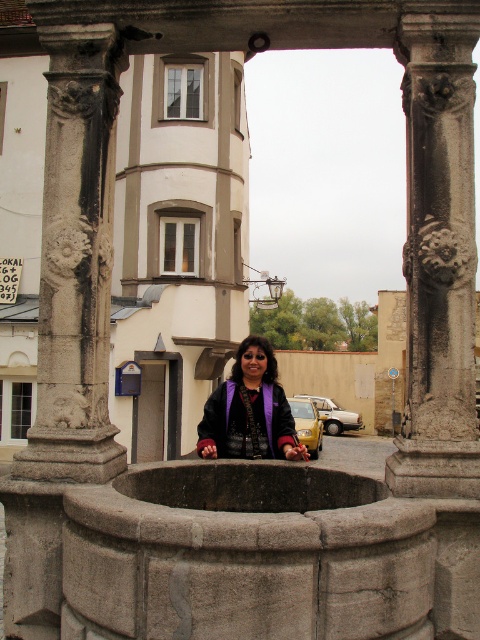
Question: Considering the real-world distances, which object is closest to the carved stone column at right?

Choices:
 (A) yellow matte car at center
 (B) carved stone column at left
 (C) purple fabric at center

Answer: (C)

Question: Can you confirm if carved stone column at left is positioned below yellow matte car at center?

Choices:
 (A) yes
 (B) no

Answer: (B)

Question: Which of the following is the closest to the observer?

Choices:
 (A) (301, 436)
 (B) (49, 182)
 (C) (420, 35)
 (D) (262, 346)

Answer: (C)

Question: Among these objects, which one is nearest to the camera?

Choices:
 (A) purple fabric at center
 (B) yellow matte car at center
 (C) carved stone column at left

Answer: (C)

Question: Is carved stone column at left closer to the viewer compared to yellow matte car at center?

Choices:
 (A) yes
 (B) no

Answer: (A)

Question: Does purple fabric at center appear over yellow matte car at center?

Choices:
 (A) no
 (B) yes

Answer: (B)